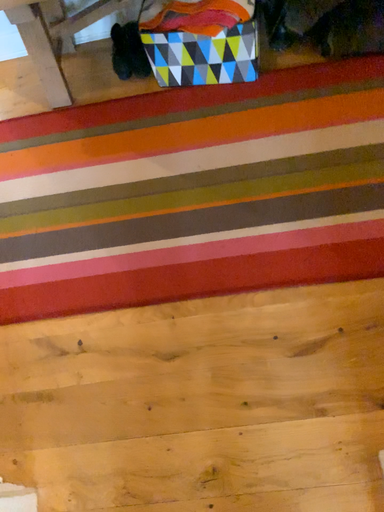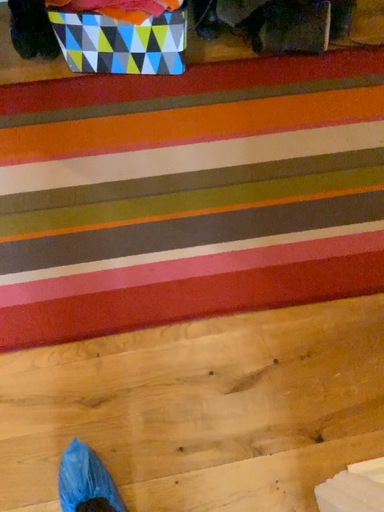
Question: How did the camera likely rotate when shooting the video?

Choices:
 (A) rotated left
 (B) rotated right

Answer: (B)